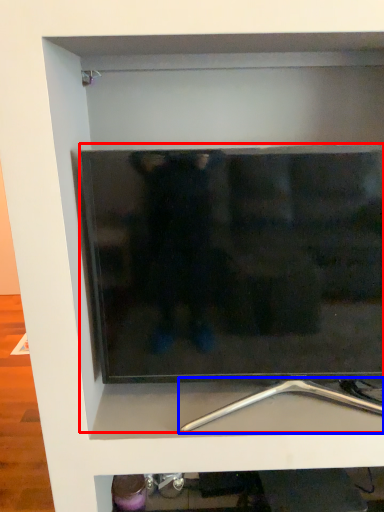
Question: Which object is closer to the camera taking this photo, television (highlighted by a red box) or silver (highlighted by a blue box)?

Choices:
 (A) television
 (B) silver

Answer: (A)